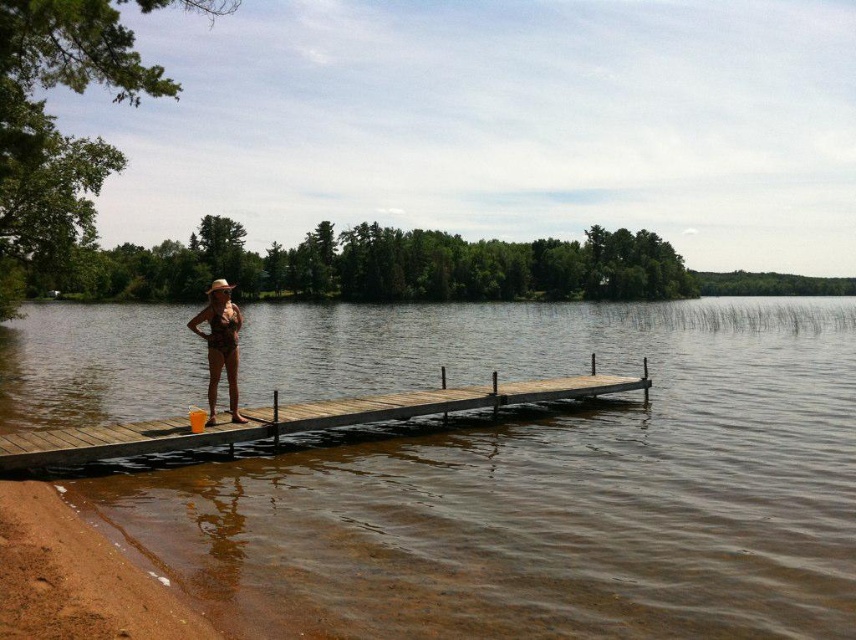
You are a photographer positioned at the shoreline. You want to capture a photo of the brown wooden dock at center and the matte brown bikini at center. Based on their positions, which object will appear larger in the photo?

The brown wooden dock at center will appear larger in the photo because it is closer to the photographer than the matte brown bikini at center.

You are a lifeguard on duty and need to place a 20cm wide first aid kit on either the wooden dock at center or the matte brown bikini at center. Which object can accommodate the first aid kit without it falling off?

The wooden dock at center is wider than the matte brown bikini at center, so the first aid kit should be placed on the wooden dock at center to ensure stability and prevent it from falling off.